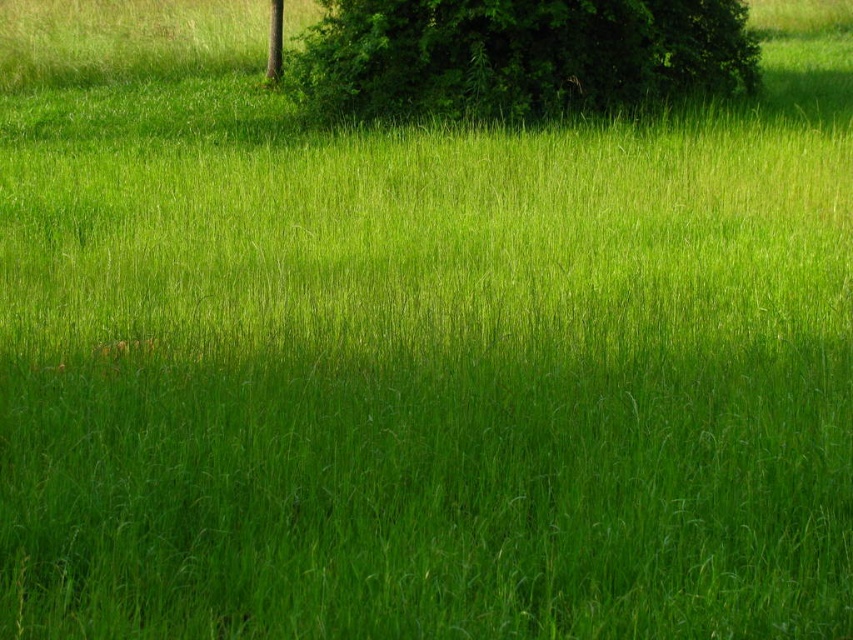
Question: Is green leafy bush at upper center above smooth brown tree trunk at upper center?

Choices:
 (A) no
 (B) yes

Answer: (A)

Question: Which point appears closest to the camera in this image?

Choices:
 (A) (462, 26)
 (B) (280, 76)

Answer: (A)

Question: Is green leafy bush at upper center positioned at the back of smooth brown tree trunk at upper center?

Choices:
 (A) yes
 (B) no

Answer: (B)

Question: Can you confirm if green leafy bush at upper center is thinner than smooth brown tree trunk at upper center?

Choices:
 (A) yes
 (B) no

Answer: (B)

Question: Among these objects, which one is farthest from the camera?

Choices:
 (A) green leafy bush at upper center
 (B) smooth brown tree trunk at upper center

Answer: (B)